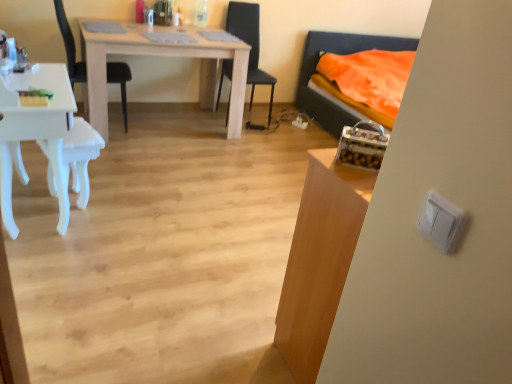
Where is `unoccupied region to the right of black leather chair at center, the first chair positioned from the right`? unoccupied region to the right of black leather chair at center, the first chair positioned from the right is located at coordinates (290, 127).